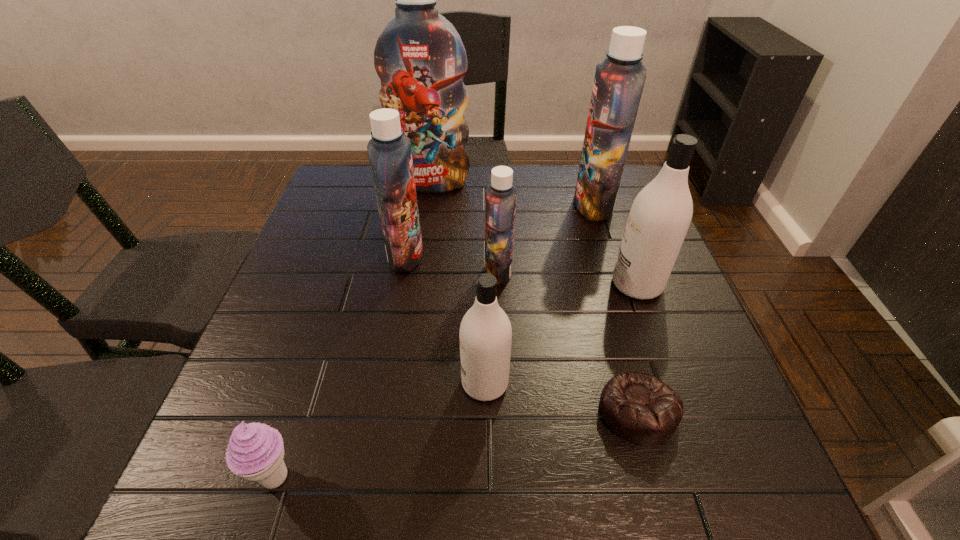
Find the location of a particular element. Image resolution: width=960 pixels, height=540 pixels. the biggest blue shampoo is located at coordinates (420, 58).

This screenshot has height=540, width=960. Find the location of `the tallest shampoo`. the tallest shampoo is located at coordinates (420, 58).

Image resolution: width=960 pixels, height=540 pixels. I want to click on the third smallest blue shampoo, so click(x=619, y=81).

Identify the location of the rightmost blue shampoo. (619, 81).

Find the location of a particular element. The image size is (960, 540). the third biggest blue shampoo is located at coordinates (389, 152).

Locate an element on the screen. the farther white shampoo is located at coordinates (660, 215).

At what (x,y) coordinates should I click in order to perform the action: click on the right white shampoo. Please return your answer as a coordinate pair (x, y). The width and height of the screenshot is (960, 540). Looking at the image, I should click on (660, 215).

The image size is (960, 540). In order to click on the smallest blue shampoo in this screenshot , I will do `click(500, 196)`.

Locate an element on the screen. the smaller white shampoo is located at coordinates tap(485, 335).

Identify the location of the nearer white shampoo. The width and height of the screenshot is (960, 540). (485, 335).